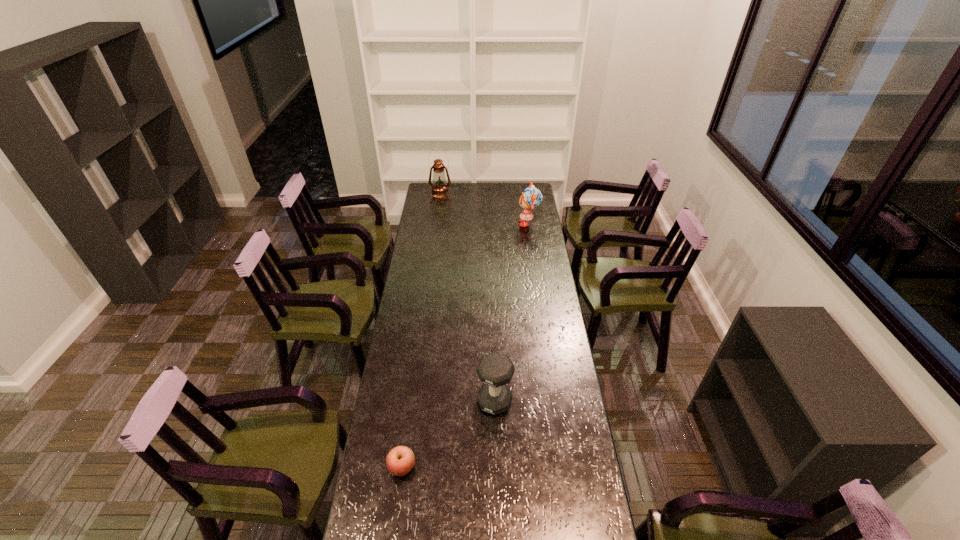
Identify the location of free space located 0.290m on the face of the doll. (469, 223).

Identify the location of free region located 0.380m on the face of the doll. This screenshot has width=960, height=540. (455, 223).

Identify the location of vacant space located on the left of the dumbbell. This screenshot has height=540, width=960. (464, 401).

Identify the location of vacant space situated 0.180m on the front of the shortest object. (392, 539).

The height and width of the screenshot is (540, 960). Identify the location of object that is at the far edge. (439, 189).

Locate an element on the screen. oil lamp at the left edge is located at coordinates (439, 189).

You are a GUI agent. You are given a task and a screenshot of the screen. Output one action in this format:
    pyautogui.click(x=<x>, y=<y>)
    Task: Click on the apple that is positioned at the left edge
    The image size is (960, 540).
    Given the screenshot: What is the action you would take?
    pyautogui.click(x=400, y=460)

This screenshot has height=540, width=960. I want to click on object located in the right edge section of the desktop, so click(x=531, y=198).

I want to click on object situated at the far left corner, so click(439, 189).

In the image, there is a desktop. Identify the location of vacant space at the far edge. (490, 195).